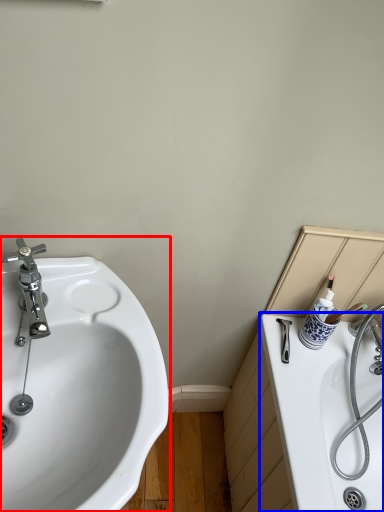
Question: Which point is further to the camera, sink (highlighted by a red box) or bath (highlighted by a blue box)?

Choices:
 (A) sink
 (B) bath

Answer: (B)